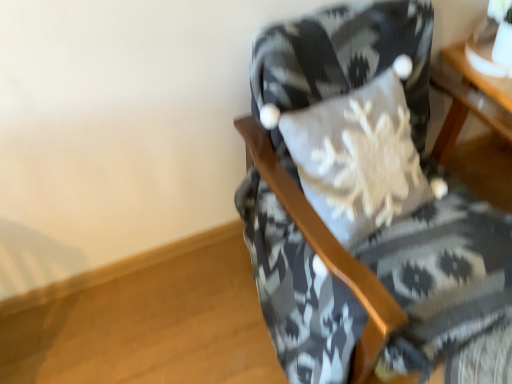
This screenshot has width=512, height=384. Describe the element at coordinates (365, 199) in the screenshot. I see `textured gray cushion at center` at that location.

The width and height of the screenshot is (512, 384). What are the coordinates of `textured gray cushion at center` in the screenshot? It's located at (365, 199).

Where is `textured gray cushion at center`? textured gray cushion at center is located at coordinates (365, 199).